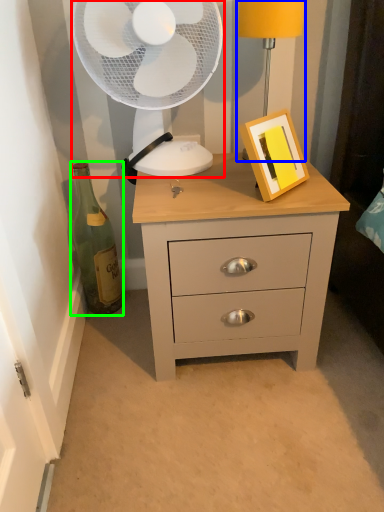
Question: Based on their relative distances, which object is farther from mechanical fan (highlighted by a red box)? Choose from bedside lamp (highlighted by a blue box) and bottle (highlighted by a green box).

Choices:
 (A) bedside lamp
 (B) bottle

Answer: (B)